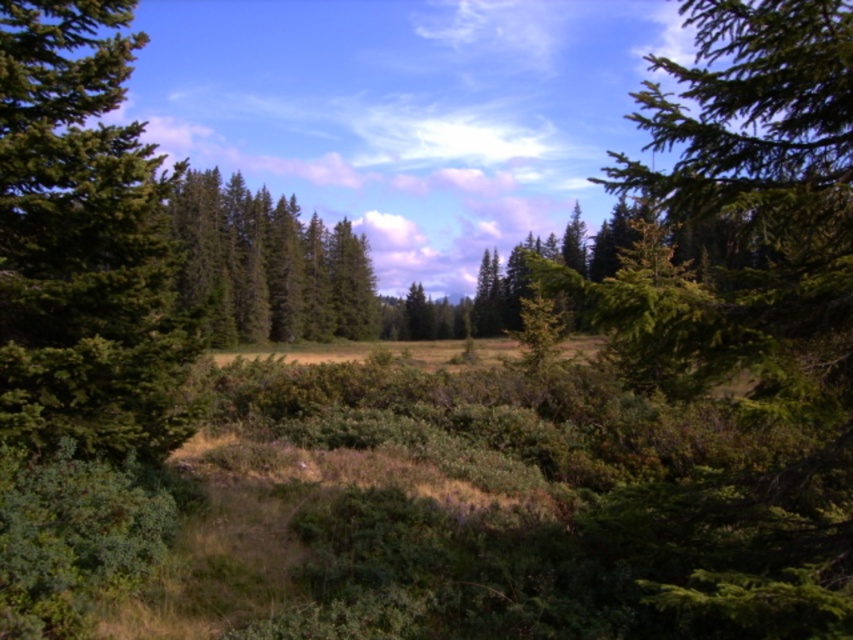
Between green matte tree at left and green matte tree at center, which one appears on the right side from the viewer's perspective?

From the viewer's perspective, green matte tree at center appears more on the right side.

Is green matte tree at left behind green matte tree at center?

No.

Does point (44, 173) lie in front of point (310, 241)?

Yes, point (44, 173) is closer to viewer.

Find the location of a particular element. green matte tree at left is located at coordinates (84, 244).